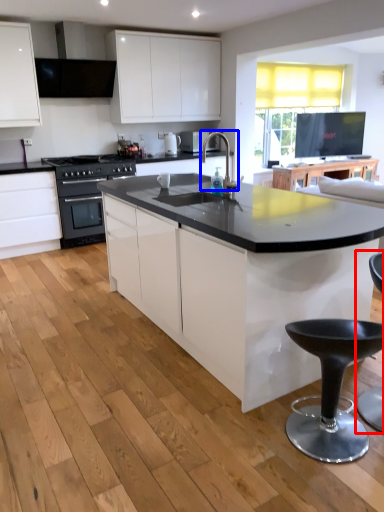
Question: Which object is closer to the camera taking this photo, swivel chair (highlighted by a red box) or open (highlighted by a blue box)?

Choices:
 (A) swivel chair
 (B) open

Answer: (A)